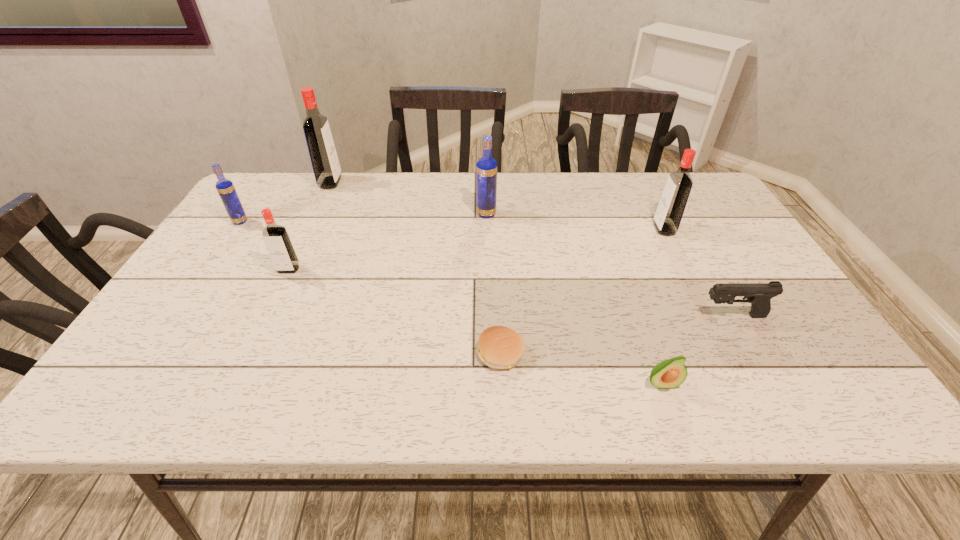
You are a GUI agent. You are given a task and a screenshot of the screen. Output one action in this format:
    pyautogui.click(x=<x>, y=<y>)
    Task: Click on the farthest vodka
    The height and width of the screenshot is (540, 960).
    Given the screenshot: What is the action you would take?
    pyautogui.click(x=323, y=155)

In order to click on the tallest vodka in this screenshot , I will do `click(323, 155)`.

Locate an element on the screen. the second vodka from right to left is located at coordinates (486, 168).

You are a GUI agent. You are given a task and a screenshot of the screen. Output one action in this format:
    pyautogui.click(x=<x>, y=<y>)
    Task: Click on the right blue vodka
    The width and height of the screenshot is (960, 540).
    Given the screenshot: What is the action you would take?
    pyautogui.click(x=486, y=168)

Image resolution: width=960 pixels, height=540 pixels. I want to click on the rightmost vodka, so click(669, 213).

Identify the location of the second smallest red vodka. The height and width of the screenshot is (540, 960). (669, 213).

You are a GUI agent. You are given a task and a screenshot of the screen. Output one action in this format:
    pyautogui.click(x=<x>, y=<y>)
    Task: Click on the left blue vodka
    This screenshot has width=960, height=540.
    Given the screenshot: What is the action you would take?
    pyautogui.click(x=226, y=190)

Locate an element on the screen. This screenshot has height=540, width=960. the smaller blue vodka is located at coordinates (226, 190).

Locate an element on the screen. This screenshot has width=960, height=540. the fifth farthest object is located at coordinates (277, 241).

I want to click on the smallest red vodka, so click(277, 241).